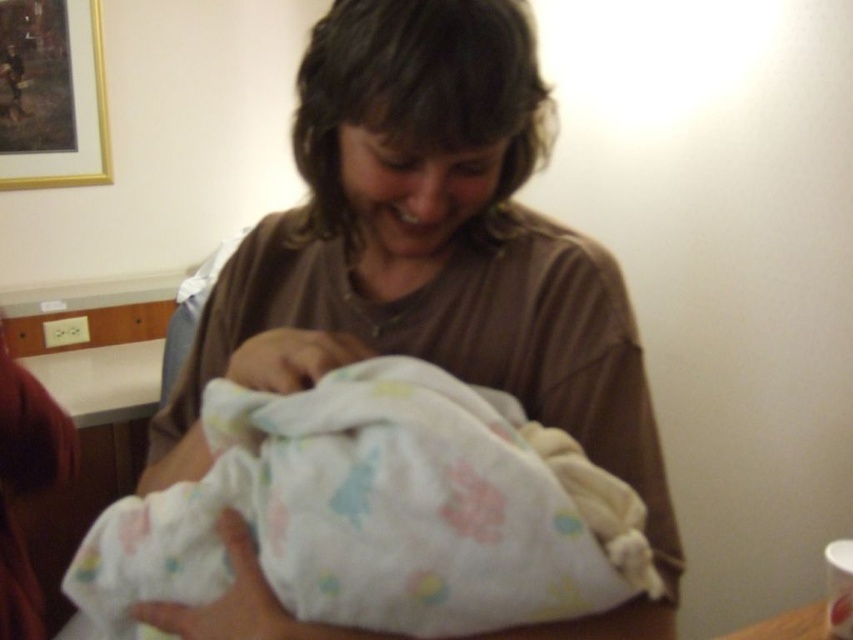
Question: Among these objects, which one is nearest to the camera?

Choices:
 (A) white soft cloth at center
 (B) fluffy white blanket at center

Answer: (B)

Question: Which object is farther from the camera taking this photo?

Choices:
 (A) fluffy white blanket at center
 (B) white soft cloth at center

Answer: (B)

Question: Where is white soft cloth at center located in relation to fluffy white blanket at center in the image?

Choices:
 (A) below
 (B) above

Answer: (B)

Question: Does white soft cloth at center have a lesser width compared to fluffy white blanket at center?

Choices:
 (A) no
 (B) yes

Answer: (A)

Question: Considering the relative positions of white soft cloth at center and fluffy white blanket at center in the image provided, where is white soft cloth at center located with respect to fluffy white blanket at center?

Choices:
 (A) right
 (B) left

Answer: (B)

Question: Which object appears closest to the camera in this image?

Choices:
 (A) white soft cloth at center
 (B) fluffy white blanket at center

Answer: (B)